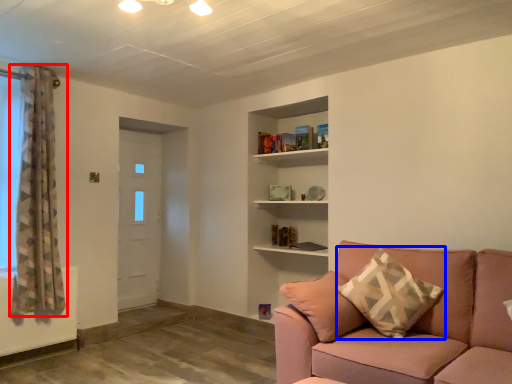
Question: Among these objects, which one is farthest to the camera, curtain (highlighted by a red box) or pillow (highlighted by a blue box)?

Choices:
 (A) curtain
 (B) pillow

Answer: (A)